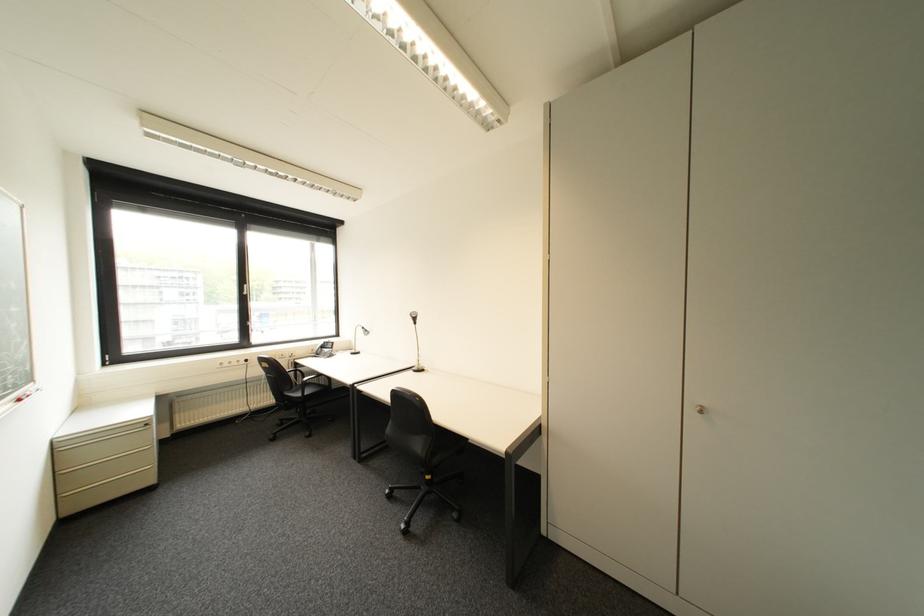
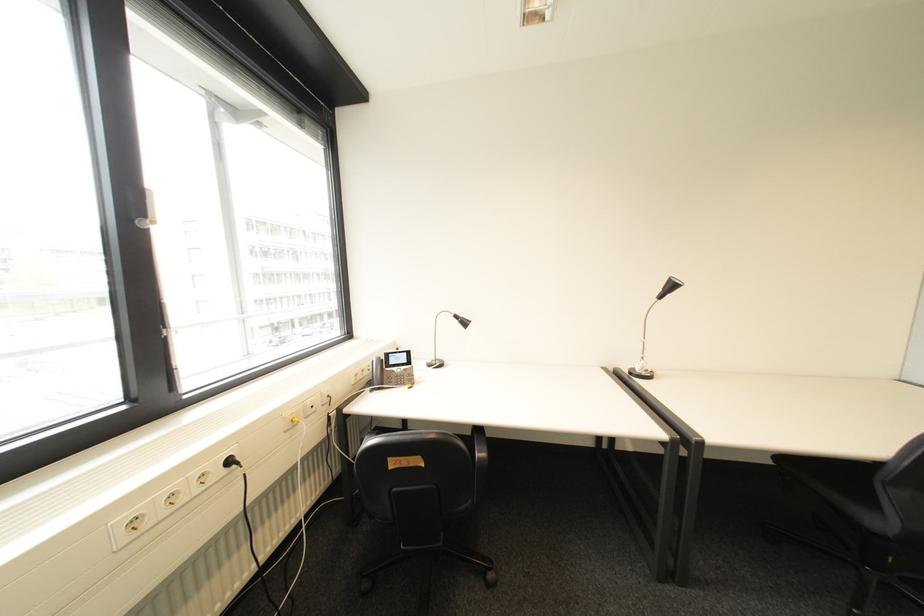
In a continuous first-person perspective shot, in which direction is the camera moving?

The cameraman moved toward left, forward.